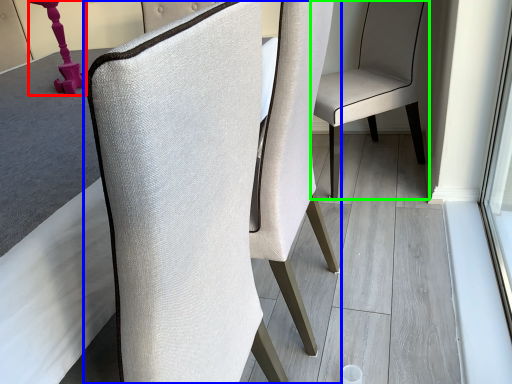
Question: Which object is positioned closest to table lamp (highlighted by a red box)? Select from chair (highlighted by a blue box) and chair (highlighted by a green box).

Choices:
 (A) chair
 (B) chair

Answer: (A)